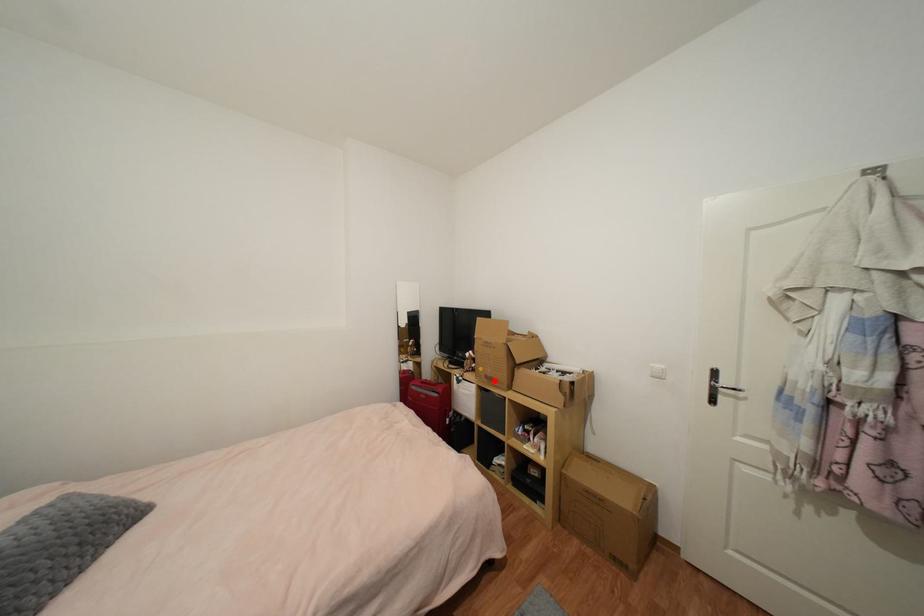
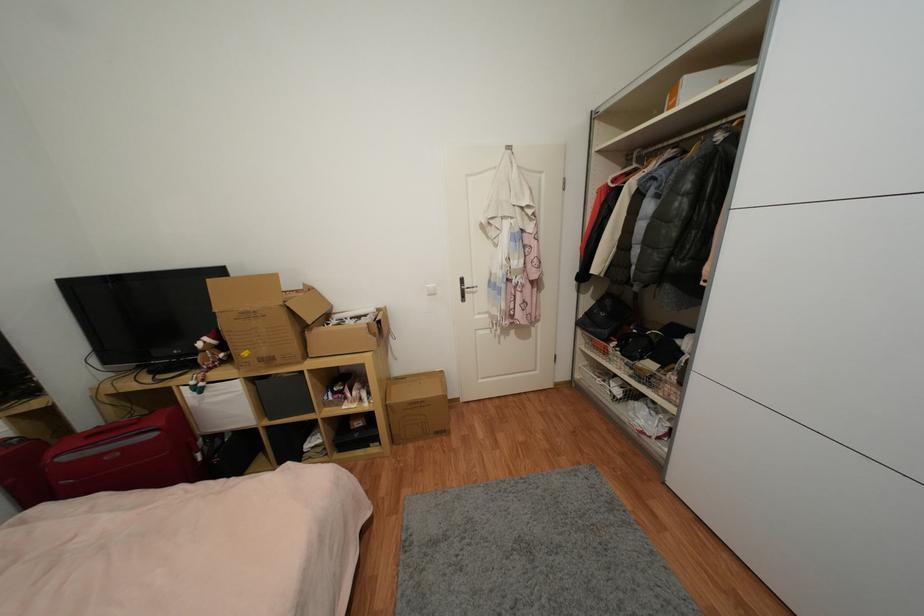
Where in the second image is the point corresponding to the highlighted location from the first image?

(274, 361)